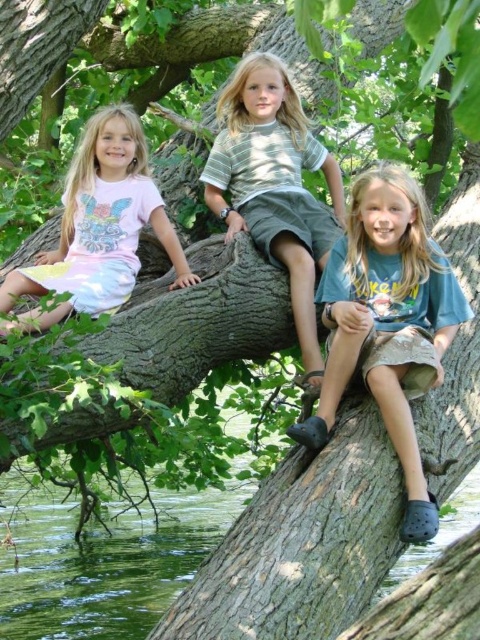
Is blue cotton shirt at center further to camera compared to pink fabric dress at left?

No.

Is point (395, 426) in front of point (86, 225)?

That is True.

Is point (310, 440) less distant than point (86, 288)?

Yes, it is in front of point (86, 288).

Where is `blue cotton shirt at center`? This screenshot has width=480, height=640. blue cotton shirt at center is located at coordinates (387, 323).

Can you confirm if blue cotton shirt at center is wider than striped cotton shirt at center?

Indeed, blue cotton shirt at center has a greater width compared to striped cotton shirt at center.

Who is taller, blue cotton shirt at center or striped cotton shirt at center?

blue cotton shirt at center

What do you see at coordinates (387, 323) in the screenshot? I see `blue cotton shirt at center` at bounding box center [387, 323].

At what (x,y) coordinates should I click in order to perform the action: click on blue cotton shirt at center. Please return your answer as a coordinate pair (x, y). The width and height of the screenshot is (480, 640). Looking at the image, I should click on (387, 323).

Is point (303, 150) less distant than point (26, 285)?

That is False.

Does striped cotton shirt at center come behind pink fabric dress at left?

Yes.

Does point (307, 118) come closer to viewer compared to point (34, 326)?

No, (307, 118) is behind (34, 326).

I want to click on striped cotton shirt at center, so click(275, 186).